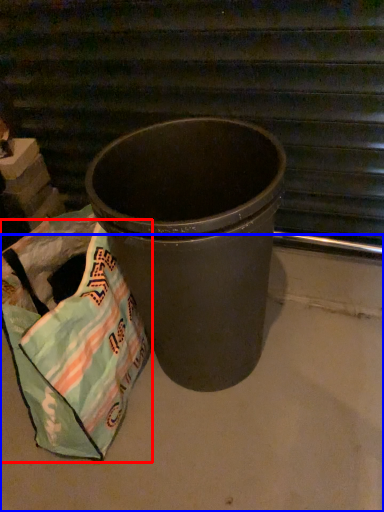
Question: Which of the following is the farthest to the observer, grocery bag (highlighted by a red box) or concrete (highlighted by a blue box)?

Choices:
 (A) grocery bag
 (B) concrete

Answer: (A)